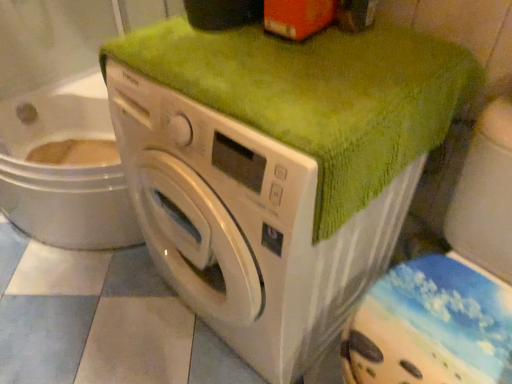
Question: Does green textured towel at upper center have a lesser height compared to green fabric-covered washer at right?

Choices:
 (A) yes
 (B) no

Answer: (A)

Question: Does green textured towel at upper center come in front of green fabric-covered washer at right?

Choices:
 (A) yes
 (B) no

Answer: (B)

Question: Considering the relative sizes of green textured towel at upper center and green fabric-covered washer at right in the image provided, is green textured towel at upper center thinner than green fabric-covered washer at right?

Choices:
 (A) no
 (B) yes

Answer: (B)

Question: Is green textured towel at upper center smaller than green fabric-covered washer at right?

Choices:
 (A) yes
 (B) no

Answer: (A)

Question: From the image's perspective, is green textured towel at upper center beneath green fabric-covered washer at right?

Choices:
 (A) yes
 (B) no

Answer: (B)

Question: From the image's perspective, is green fabric-covered washer at right located above or below white glossy washing machine at center?

Choices:
 (A) below
 (B) above

Answer: (A)

Question: Is green fabric-covered washer at right inside the boundaries of white glossy washing machine at center, or outside?

Choices:
 (A) inside
 (B) outside

Answer: (B)

Question: Looking at their shapes, would you say green fabric-covered washer at right is wider or thinner than white glossy washing machine at center?

Choices:
 (A) wide
 (B) thin

Answer: (B)

Question: Is green fabric-covered washer at right in front of or behind white glossy washing machine at center in the image?

Choices:
 (A) behind
 (B) front

Answer: (B)

Question: From the image's perspective, is green textured towel at upper center above or below green fabric-covered washer at right?

Choices:
 (A) below
 (B) above

Answer: (B)

Question: Is green textured towel at upper center inside or outside of green fabric-covered washer at right?

Choices:
 (A) outside
 (B) inside

Answer: (A)

Question: In the image, is green textured towel at upper center on the left side or the right side of green fabric-covered washer at right?

Choices:
 (A) left
 (B) right

Answer: (A)

Question: In terms of size, does green textured towel at upper center appear bigger or smaller than green fabric-covered washer at right?

Choices:
 (A) small
 (B) big

Answer: (A)

Question: Is green fabric-covered washer at right spatially inside green textured towel at upper center, or outside of it?

Choices:
 (A) outside
 (B) inside

Answer: (A)

Question: Considering their positions, is green fabric-covered washer at right located in front of or behind green textured towel at upper center?

Choices:
 (A) front
 (B) behind

Answer: (A)